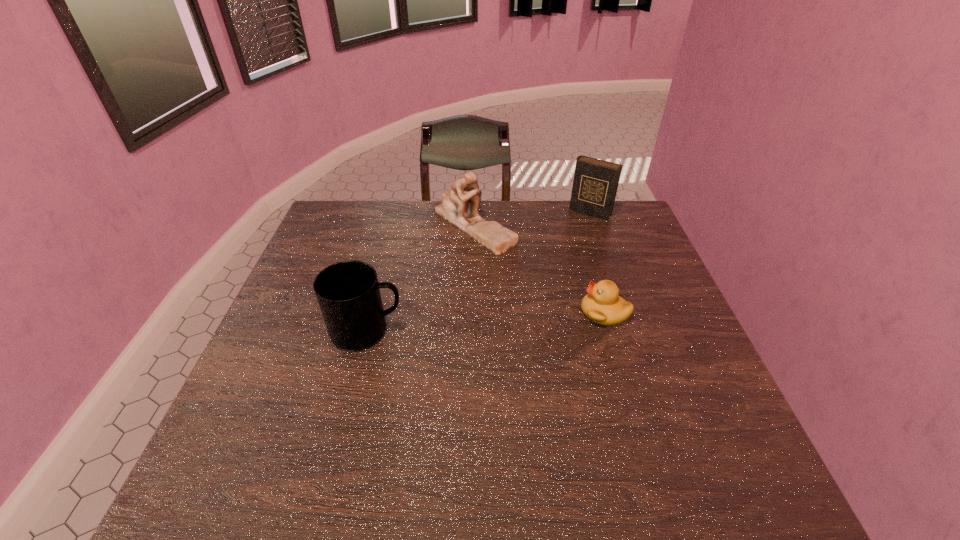
The height and width of the screenshot is (540, 960). What are the coordinates of `free space on the desktop that is between the leftmost object and the shortest object and is positioned on the front cover of the diary` in the screenshot? It's located at (511, 320).

This screenshot has height=540, width=960. Identify the location of vacant space on the desktop that is between the mug and the duckling and is positioned on the front-facing side of the figurine. (461, 323).